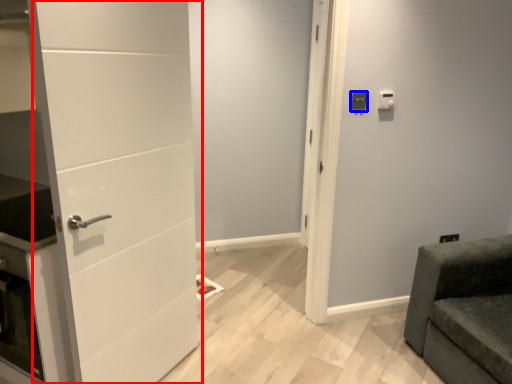
Question: Which point is closer to the camera, door (highlighted by a red box) or light switch (highlighted by a blue box)?

Choices:
 (A) door
 (B) light switch

Answer: (A)